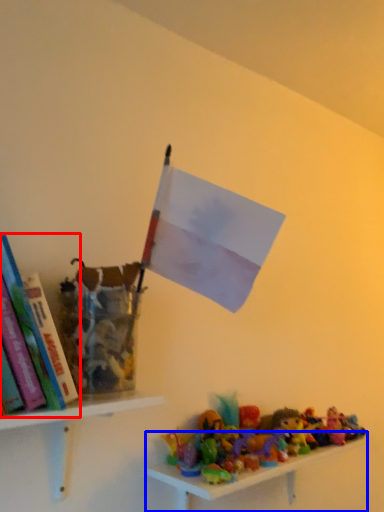
Question: Which object is closer to the camera taking this photo, book (highlighted by a red box) or shelf (highlighted by a blue box)?

Choices:
 (A) book
 (B) shelf

Answer: (A)